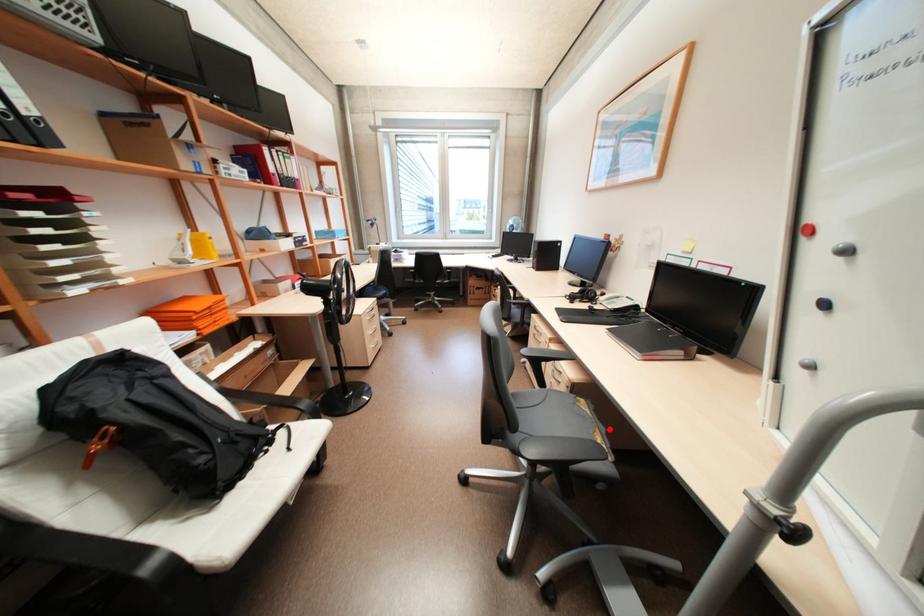
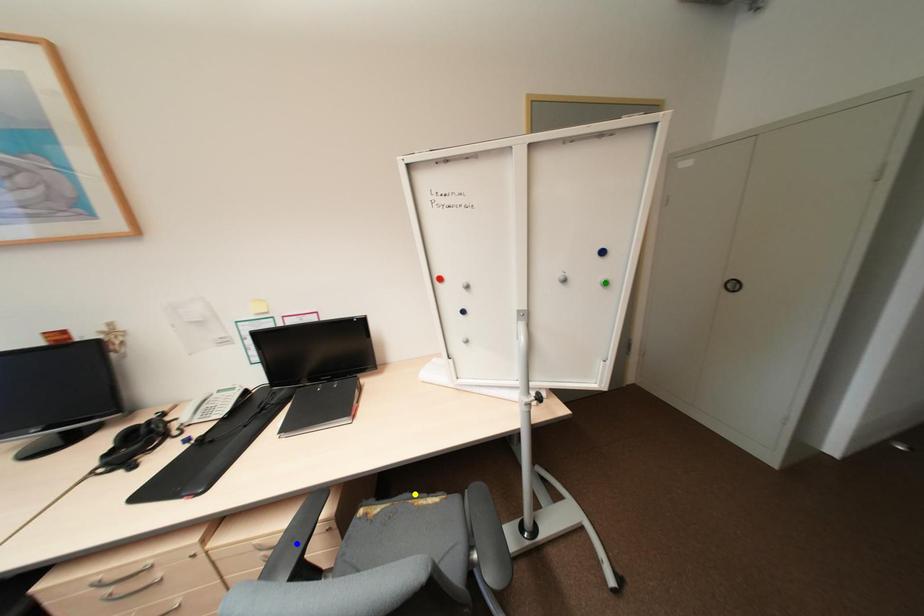
Question: I am providing you with two images of the same scene from different viewpoints. A red point is marked on the first image. You are given multiple points on the second image. Can you choose the point in image 2 that corresponds to the point in image 1?

Choices:
 (A) green point
 (B) blue point
 (C) yellow point

Answer: (C)